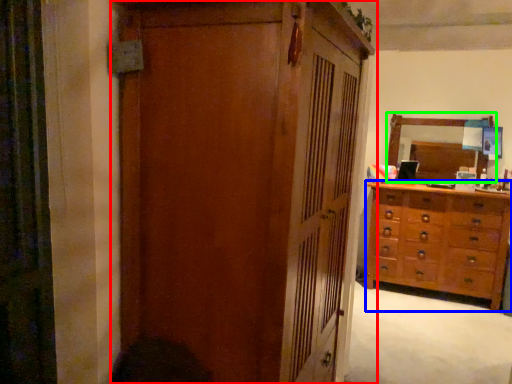
Question: Which object is positioned farthest from cupboard (highlighted by a red box)? Select from chest of drawers (highlighted by a blue box) and mirror (highlighted by a green box).

Choices:
 (A) chest of drawers
 (B) mirror

Answer: (B)